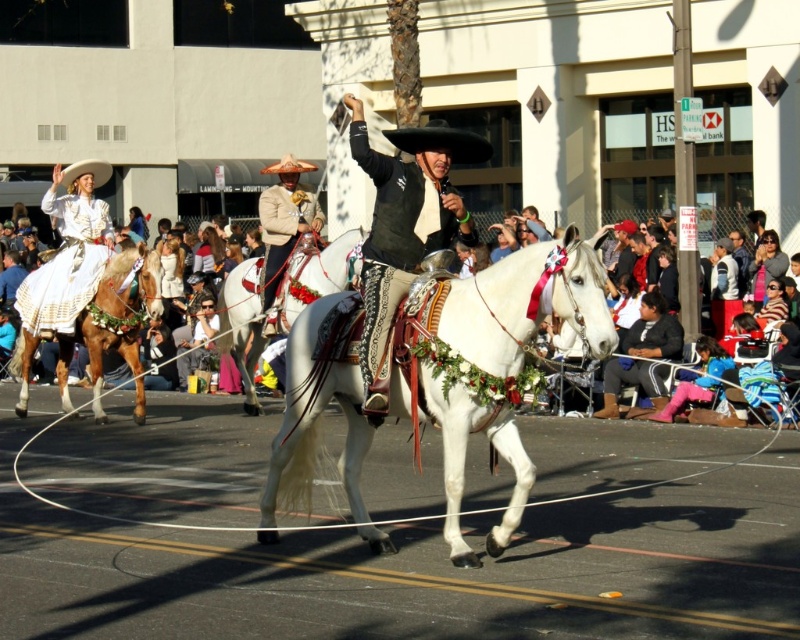
You are a photographer standing at the camera position. You want to take a photo of the white leather horse at center. If your camera has a maximum focus range of 15 meters, will you be able to focus on the horse?

The white leather horse at center is 15.50 meters away from the camera, which exceeds the camera maximum focus range of 15 meters. Therefore, the camera cannot focus on the horse.

You are a photographer standing at the point labeled point [441,141] in the image. You want to capture a photo of the black felt cowboy hat at center. Is the point you are standing at the correct location to take the photo?

Yes, the point [441,141] corresponds to the black felt cowboy hat at center, so standing there would allow you to take the photo.